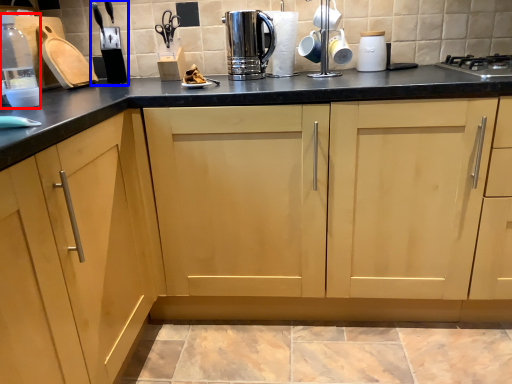
Question: Which of the following is the closest to the observer, bottle (highlighted by a red box) or appliance (highlighted by a blue box)?

Choices:
 (A) bottle
 (B) appliance

Answer: (A)